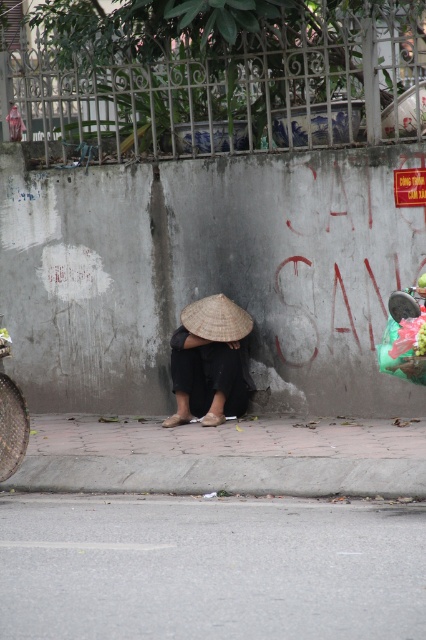
You are a delivery robot that needs to place a package on the gray asphalt pavement at lower center. You are currently holding the matte straw hat at center. Can you safely move the hat to the pavement without dropping it?

The gray asphalt pavement at lower center is 3.14 meters away from the matte straw hat at center. Since the distance is manageable, the delivery robot can safely move the matte straw hat at center to the gray asphalt pavement at lower center without dropping it.

You are standing at the edge of the urban street scene. You want to place a small object exactly at the center of the gray asphalt pavement at lower center. What coordinates should you use?

The coordinates for the center of the gray asphalt pavement at lower center are point (210, 566).

You are a delivery person who needs to place a small package on the ground. You see the gray asphalt pavement at lower center and the matte straw hat at center. Which surface is lower to the ground?

The gray asphalt pavement at lower center is lower to the ground than the matte straw hat at center.